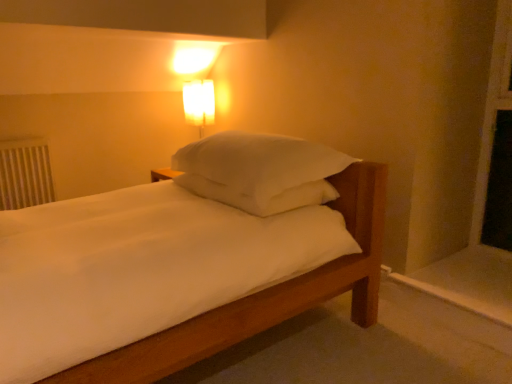
Identify the location of empty space that is ontop of white painted wood at lower right (from a real-world perspective). The height and width of the screenshot is (384, 512). (470, 277).